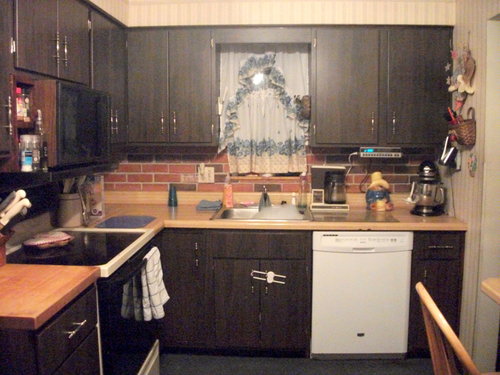
The width and height of the screenshot is (500, 375). I want to click on oven, so (126, 319).